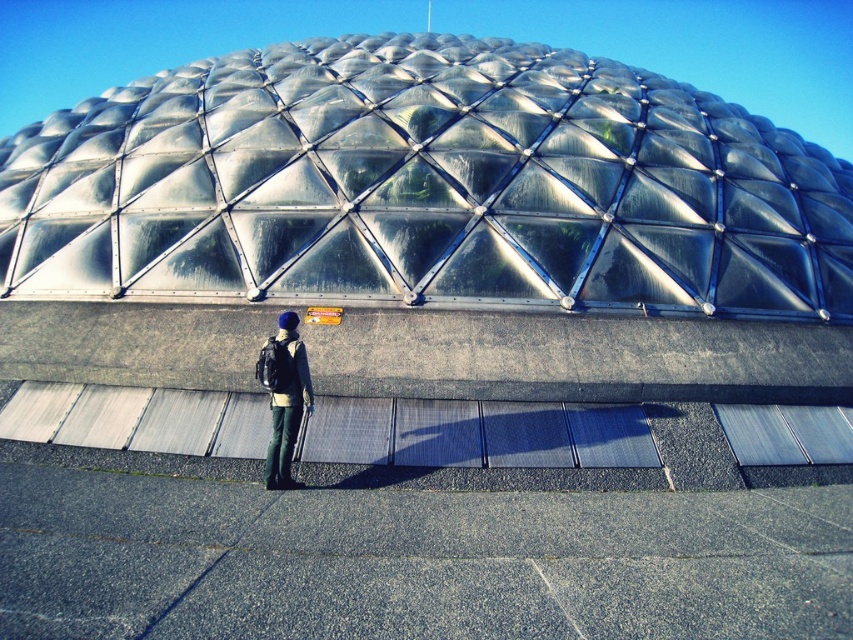
Question: Which point is farther to the camera?

Choices:
 (A) (277, 388)
 (B) (682, 211)

Answer: (B)

Question: Can you confirm if metallic silver dome at upper center is thinner than dark blue fabric backpack at center?

Choices:
 (A) no
 (B) yes

Answer: (A)

Question: Which point is closer to the camera?

Choices:
 (A) (833, 282)
 (B) (291, 369)

Answer: (B)

Question: Can you confirm if metallic silver dome at upper center is positioned above dark blue fabric backpack at center?

Choices:
 (A) no
 (B) yes

Answer: (B)

Question: Which point is farther to the camera?

Choices:
 (A) metallic silver dome at upper center
 (B) dark blue fabric backpack at center

Answer: (A)

Question: Can you confirm if metallic silver dome at upper center is smaller than dark blue fabric backpack at center?

Choices:
 (A) yes
 (B) no

Answer: (B)